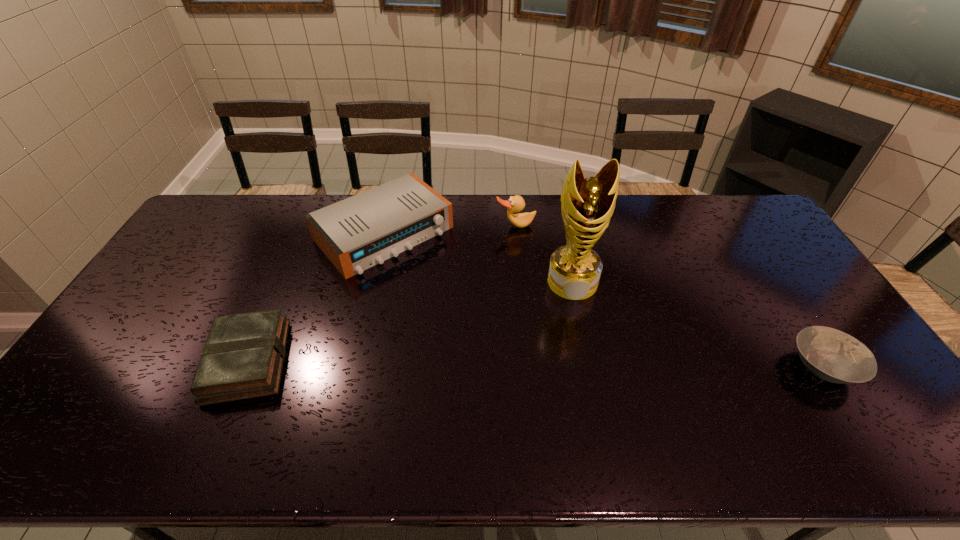
Locate an element on the screen. book is located at coordinates tap(243, 357).

In order to click on the rightmost object in this screenshot , I will do `click(832, 355)`.

Locate an element on the screen. the third tallest object is located at coordinates (364, 230).

Locate an element on the screen. the tallest object is located at coordinates (587, 204).

The width and height of the screenshot is (960, 540). I want to click on award, so click(587, 204).

The width and height of the screenshot is (960, 540). Find the location of `the third object from left to right`. the third object from left to right is located at coordinates (516, 203).

This screenshot has width=960, height=540. Find the location of `duck`. duck is located at coordinates (516, 203).

I want to click on vacant space located 0.110m on the back of the book, so click(277, 293).

This screenshot has width=960, height=540. I want to click on blank space located on the left of the bowl, so click(743, 367).

You are a GUI agent. You are given a task and a screenshot of the screen. Output one action in this format:
    pyautogui.click(x=<x>, y=<y>)
    Task: Click on the vacant space located 0.340m on the control panel of the radio receiver
    
    Given the screenshot: What is the action you would take?
    pyautogui.click(x=489, y=334)